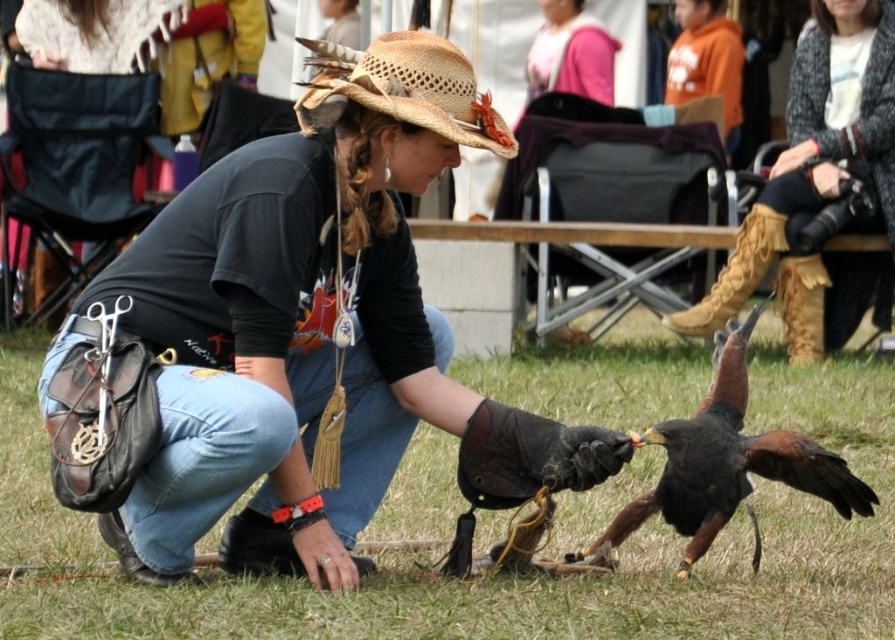
Is leather fringe boots at lower right smaller than straw hat at center?

Incorrect, leather fringe boots at lower right is not smaller in size than straw hat at center.

Can you confirm if leather fringe boots at lower right is positioned to the right of straw hat at center?

Yes, leather fringe boots at lower right is to the right of straw hat at center.

Find the location of a particular element. leather fringe boots at lower right is located at coordinates (815, 172).

Does matte black shirt at center have a greater width compared to straw hat at center?

Indeed, matte black shirt at center has a greater width compared to straw hat at center.

Between matte black shirt at center and straw hat at center, which one appears on the left side from the viewer's perspective?

Positioned to the left is matte black shirt at center.

Is point (590, 476) in front of point (469, 112)?

No, it is not.

You are a GUI agent. You are given a task and a screenshot of the screen. Output one action in this format:
    pyautogui.click(x=<x>, y=<y>)
    Task: Click on the matte black shirt at center
    This screenshot has width=895, height=640.
    Given the screenshot: What is the action you would take?
    pyautogui.click(x=297, y=339)

Is point (697, 540) more distant than point (533, 44)?

No.

Which is below, brown feathered falcon at lower right or matte pink sweater at upper center?

brown feathered falcon at lower right

What do you see at coordinates (727, 461) in the screenshot? I see `brown feathered falcon at lower right` at bounding box center [727, 461].

At what (x,y) coordinates should I click in order to perform the action: click on brown feathered falcon at lower right. Please return your answer as a coordinate pair (x, y). This screenshot has height=640, width=895. Looking at the image, I should click on (727, 461).